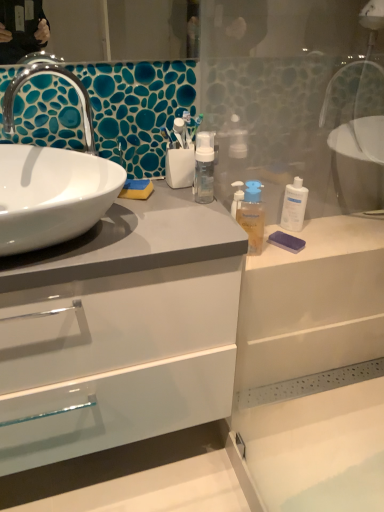
The width and height of the screenshot is (384, 512). What do you see at coordinates (252, 216) in the screenshot? I see `translucent plastic mouthwash at center, the first mouthwash when ordered from front to back` at bounding box center [252, 216].

Where is `white glossy cabinet at left`? The width and height of the screenshot is (384, 512). white glossy cabinet at left is located at coordinates (194, 367).

Image resolution: width=384 pixels, height=512 pixels. In order to click on translucent plastic mouthwash at center, acting as the second mouthwash starting from the right in this screenshot , I will do `click(252, 216)`.

Which is in front, purple matte bar of soap at right or translucent plastic mouthwash at center, acting as the second mouthwash starting from the back?

translucent plastic mouthwash at center, acting as the second mouthwash starting from the back.

Which of these two, purple matte bar of soap at right or translucent plastic mouthwash at center, the first mouthwash when ordered from front to back, is bigger?

translucent plastic mouthwash at center, the first mouthwash when ordered from front to back.

Can translucent plastic mouthwash at center, the first mouthwash when ordered from front to back, be found inside purple matte bar of soap at right?

No, purple matte bar of soap at right does not contain translucent plastic mouthwash at center, the first mouthwash when ordered from front to back.

Is translucent plastic mouthwash at center, acting as the second mouthwash starting from the right, facing towards white glossy sink at left?

No, translucent plastic mouthwash at center, acting as the second mouthwash starting from the right, is not facing towards white glossy sink at left.

Which is more to the right, translucent plastic mouthwash at center, acting as the second mouthwash starting from the right, or white glossy sink at left?

translucent plastic mouthwash at center, acting as the second mouthwash starting from the right.

Are translucent plastic mouthwash at center, which appears as the first mouthwash when viewed from the left, and white glossy sink at left making contact?

translucent plastic mouthwash at center, which appears as the first mouthwash when viewed from the left, is not next to white glossy sink at left, and they're not touching.

Is purple matte bar of soap at right at the back of white glossy sink at left?

That's right, white glossy sink at left is facing away from purple matte bar of soap at right.

Is point (66, 201) positioned before point (299, 250)?

Yes, point (66, 201) is closer to viewer.

Where is `sink above the purple matte bar of soap at right (from the image's perspective)`? Image resolution: width=384 pixels, height=512 pixels. sink above the purple matte bar of soap at right (from the image's perspective) is located at coordinates (51, 181).

In the image, is white glossy sink at left on the left side or the right side of purple matte bar of soap at right?

Based on their positions, white glossy sink at left is located to the left of purple matte bar of soap at right.

Measure the distance from white plastic bottle at right, the second mouthwash from the left, to white glossy cabinet at left.

white plastic bottle at right, the second mouthwash from the left, and white glossy cabinet at left are 22.49 inches apart.

Image resolution: width=384 pixels, height=512 pixels. I want to click on the 2nd mouthwash behind when counting from the white glossy cabinet at left, so click(x=294, y=205).

Is white glossy cabinet at left surrounded by white plastic bottle at right, positioned as the 1th mouthwash in back-to-front order?

No, white glossy cabinet at left is not inside white plastic bottle at right, positioned as the 1th mouthwash in back-to-front order.

Based on the photo, from a real-world perspective, is white plastic bottle at right, positioned as the 1th mouthwash in back-to-front order, above or below white glossy cabinet at left?

From a real-world perspective, white plastic bottle at right, positioned as the 1th mouthwash in back-to-front order, is physically above white glossy cabinet at left.

From a real-world perspective, which object rests below the other?

purple matte bar of soap at right.

Is point (245, 199) closer or farther from the camera than point (270, 242)?

Point (245, 199) is positioned farther from the camera compared to point (270, 242).

Is translucent plastic mouthwash at center, acting as the second mouthwash starting from the back, positioned beyond the bounds of purple matte bar of soap at right?

Yes, translucent plastic mouthwash at center, acting as the second mouthwash starting from the back, is not within purple matte bar of soap at right.

Is translucent plastic mouthwash at center, which appears as the first mouthwash when viewed from the left, further to the viewer compared to purple matte bar of soap at right?

No, translucent plastic mouthwash at center, which appears as the first mouthwash when viewed from the left, is in front of purple matte bar of soap at right.

Does point (291, 201) appear closer or farther from the camera than point (259, 243)?

Point (291, 201).

What's the angular difference between white plastic bottle at right, marked as the second mouthwash in a front-to-back arrangement, and translucent plastic mouthwash at center, acting as the second mouthwash starting from the back,'s facing directions?

There is a 31.2-degree angle between the facing directions of white plastic bottle at right, marked as the second mouthwash in a front-to-back arrangement, and translucent plastic mouthwash at center, acting as the second mouthwash starting from the back.

Is white plastic bottle at right, marked as the second mouthwash in a front-to-back arrangement, oriented towards translucent plastic mouthwash at center, acting as the second mouthwash starting from the back?

No, white plastic bottle at right, marked as the second mouthwash in a front-to-back arrangement, is not turned towards translucent plastic mouthwash at center, acting as the second mouthwash starting from the back.

From the image's perspective, is white plastic bottle at right, the second mouthwash from the left, beneath translucent plastic mouthwash at center, acting as the second mouthwash starting from the right?

No.

Can you confirm if translucent plastic mouthwash at center, acting as the second mouthwash starting from the right, is taller than white plastic bottle at right, marked as the second mouthwash in a front-to-back arrangement?

Correct, translucent plastic mouthwash at center, acting as the second mouthwash starting from the right, is much taller as white plastic bottle at right, marked as the second mouthwash in a front-to-back arrangement.

Could you tell me if translucent plastic mouthwash at center, acting as the second mouthwash starting from the back, is turned towards white plastic bottle at right, the second mouthwash from the left?

No, translucent plastic mouthwash at center, acting as the second mouthwash starting from the back, is not aimed at white plastic bottle at right, the second mouthwash from the left.

Is the position of translucent plastic mouthwash at center, the first mouthwash when ordered from front to back, more distant than that of white plastic bottle at right, positioned as the 1th mouthwash in back-to-front order?

No.

From a real-world perspective, which object stands above the other?

From a 3D spatial view, translucent plastic mouthwash at center, acting as the second mouthwash starting from the back, is above.

From the image's perspective, which mouthwash is the 1st one above the purple matte bar of soap at right? Please provide its 2D coordinates.

[(252, 216)]

Locate an element on the screen. sink located above the translucent plastic mouthwash at center, acting as the second mouthwash starting from the back (from a real-world perspective) is located at coordinates (51, 181).

From the image, which object appears to be farther from white plastic bottle at right, marked as the second mouthwash in a front-to-back arrangement, translucent plastic mouthwash at center, acting as the second mouthwash starting from the right, or purple matte bar of soap at right?

purple matte bar of soap at right is positioned further to the anchor white plastic bottle at right, marked as the second mouthwash in a front-to-back arrangement.

Based on their spatial positions, is purple matte bar of soap at right or white plastic bottle at right, marked as the second mouthwash in a front-to-back arrangement, closer to white glossy cabinet at left?

purple matte bar of soap at right.

Based on their spatial positions, is white glossy cabinet at left or white plastic bottle at right, marked as the second mouthwash in a front-to-back arrangement, further from translucent plastic mouthwash at center, the first mouthwash when ordered from front to back?

white glossy cabinet at left.

Based on their spatial positions, is purple matte bar of soap at right or white plastic bottle at right, positioned as the 1th mouthwash in back-to-front order, closer to translucent plastic mouthwash at center, which appears as the first mouthwash when viewed from the left?

purple matte bar of soap at right lies closer to translucent plastic mouthwash at center, which appears as the first mouthwash when viewed from the left, than the other object.

Looking at the image, which one is located further to white glossy sink at left, white glossy cabinet at left or white plastic bottle at right, marked as the second mouthwash in a front-to-back arrangement?

Based on the image, white plastic bottle at right, marked as the second mouthwash in a front-to-back arrangement, appears to be further to white glossy sink at left.

Based on the photo, looking at the image, which one is located closer to purple matte bar of soap at right, white glossy sink at left or white plastic bottle at right, the second mouthwash from the left?

white plastic bottle at right, the second mouthwash from the left, is positioned closer to the anchor purple matte bar of soap at right.

Which object lies further to the anchor point white glossy cabinet at left, purple matte bar of soap at right or white glossy sink at left?

Based on the image, purple matte bar of soap at right appears to be further to white glossy cabinet at left.

Estimate the real-world distances between objects in this image. Which object is further from white glossy cabinet at left, white glossy sink at left or white plastic bottle at right, the first mouthwash in the right-to-left sequence?

Based on the image, white plastic bottle at right, the first mouthwash in the right-to-left sequence, appears to be further to white glossy cabinet at left.

Image resolution: width=384 pixels, height=512 pixels. I want to click on mouthwash situated between white glossy cabinet at left and white plastic bottle at right, the second mouthwash from the left, from left to right, so click(x=252, y=216).

Find the location of `bathroom cabinet situated between white glossy sink at left and white plastic bottle at right, marked as the second mouthwash in a front-to-back arrangement, from left to right`. bathroom cabinet situated between white glossy sink at left and white plastic bottle at right, marked as the second mouthwash in a front-to-back arrangement, from left to right is located at coordinates (194, 367).

Identify the location of mouthwash located between white glossy sink at left and white plastic bottle at right, positioned as the 1th mouthwash in back-to-front order, in the left-right direction. The height and width of the screenshot is (512, 384). (252, 216).

Locate an element on the screen. bathroom cabinet between white glossy sink at left and translucent plastic mouthwash at center, acting as the second mouthwash starting from the right is located at coordinates (194, 367).